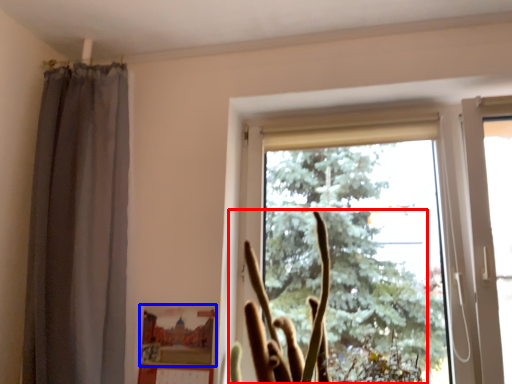
Question: Among these objects, which one is nearest to the camera, plant (highlighted by a red box) or picture frame (highlighted by a blue box)?

Choices:
 (A) plant
 (B) picture frame

Answer: (A)